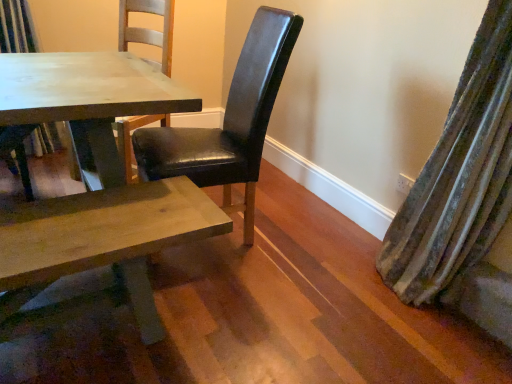
Question: From the image's perspective, relative to black leather chair at center, arranged as the second chair when viewed from the left, is matte black chair at center, placed as the 2th chair when sorted from right to left, above or below?

Choices:
 (A) above
 (B) below

Answer: (A)

Question: From a real-world perspective, relative to black leather chair at center, arranged as the second chair when viewed from the left, is matte black chair at center, the second chair viewed from the front, vertically above or below?

Choices:
 (A) below
 (B) above

Answer: (A)

Question: Which of these objects is positioned farthest from the matte wooden table at center?

Choices:
 (A) velvet green curtain at right
 (B) black leather chair at center, arranged as the second chair when viewed from the left
 (C) matte black chair at center, placed as the 2th chair when sorted from right to left

Answer: (A)

Question: Which object is positioned farthest from the matte wooden table at center?

Choices:
 (A) black leather chair at center, the 1th chair viewed from the right
 (B) velvet green curtain at right
 (C) matte black chair at center, placed as the 2th chair when sorted from right to left

Answer: (B)